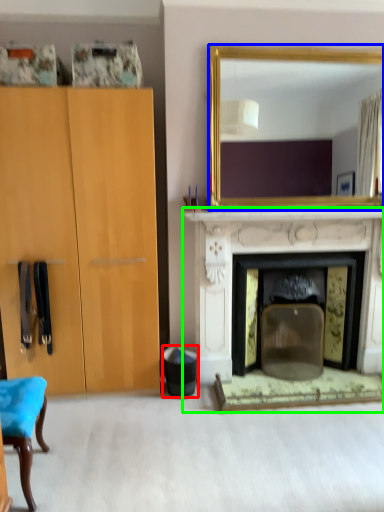
Question: Which object is the closest to the trash bin/can (highlighted by a red box)? Choose among these: mirror (highlighted by a blue box) or fireplace (highlighted by a green box).

Choices:
 (A) mirror
 (B) fireplace

Answer: (B)